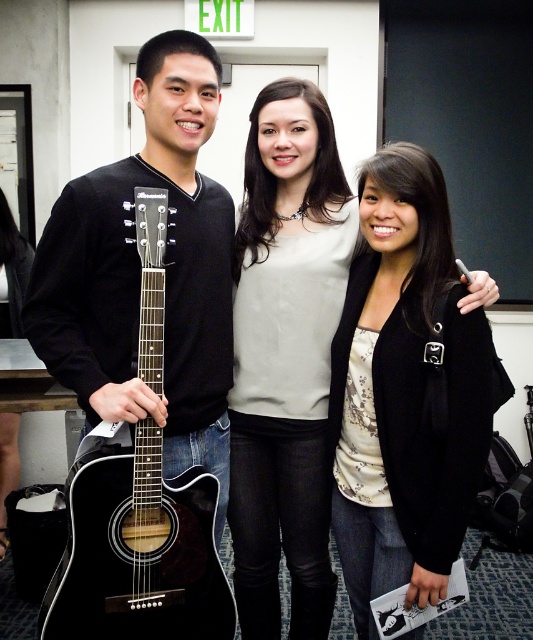
You are a photographer setting up for a photoshoot in this backstage area. You want to ensure the black acoustic guitar at left is visible in the frame without being blocked by the black matte jacket at center. Based on their positions, is this possible?

Yes, the black acoustic guitar at left is behind the black matte jacket at center, so adjusting the camera angle or moving the person with the jacket slightly forward could allow the guitar to be visible without obstruction.

You are standing in a backstage area and need to reach a specific point marked at coordinates point (x=305, y=364). If you are exactly 1.73 meters away from this point, can you reach it without moving closer?

The distance of point (x=305, y=364) from viewer is 1.73 meters, so you are already at the correct distance to reach it without needing to move closer.